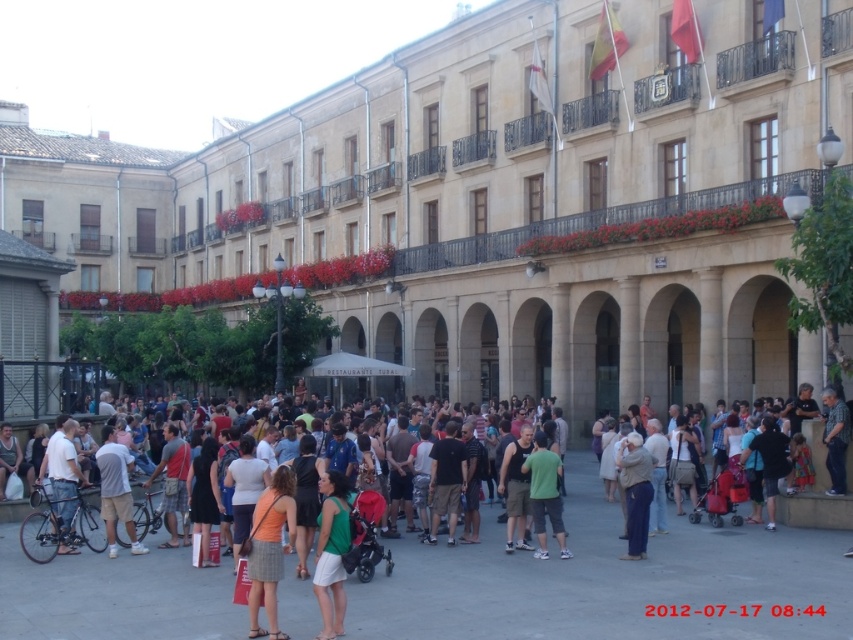
You are standing in the public square and want to take a photo of both the green matte dress at lower center and the matte black bicycle at lower left. Which object should you focus on first to ensure both are in frame?

You should focus on the green matte dress at lower center first because it is closer to you than the matte black bicycle at lower left, so adjusting the camera to include both would require starting with the closer object.

You are a photographer at the event and want to capture both the green matte dress at lower center and the green matte shirt at center in a single photo. However, you can only focus on one subject at a time. Which subject should you focus on to ensure the other is still in the background?

You should focus on the green matte dress at lower center because it is in front of the green matte shirt at center, so the shirt will be in the background when the dress is in focus.